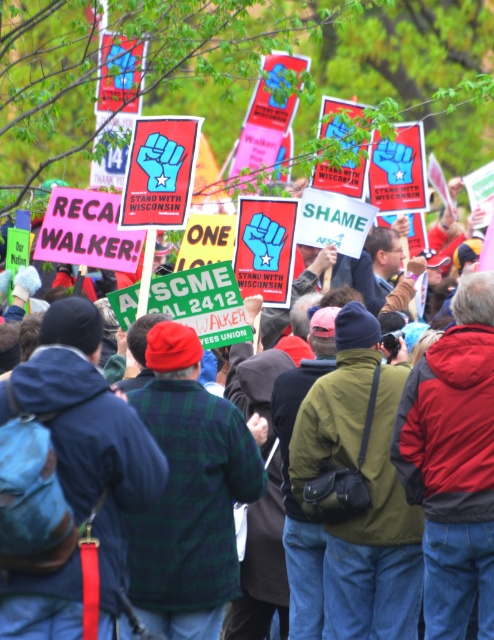
Question: Which point is closer to the camera?

Choices:
 (A) green plaid shirt at center
 (B) red jacket at center
 (C) green fabric jacket at center

Answer: (B)

Question: Can you confirm if green fabric jacket at center is wider than green plaid shirt at center?

Choices:
 (A) yes
 (B) no

Answer: (B)

Question: Which object is the closest to the green plaid shirt at center?

Choices:
 (A) red jacket at center
 (B) green fabric jacket at center

Answer: (B)

Question: Is red jacket at center positioned behind green plaid shirt at center?

Choices:
 (A) yes
 (B) no

Answer: (B)

Question: Estimate the real-world distances between objects in this image. Which object is closer to the red jacket at center?

Choices:
 (A) green fabric jacket at center
 (B) green plaid shirt at center

Answer: (A)

Question: Does red jacket at center have a smaller size compared to green plaid shirt at center?

Choices:
 (A) no
 (B) yes

Answer: (B)